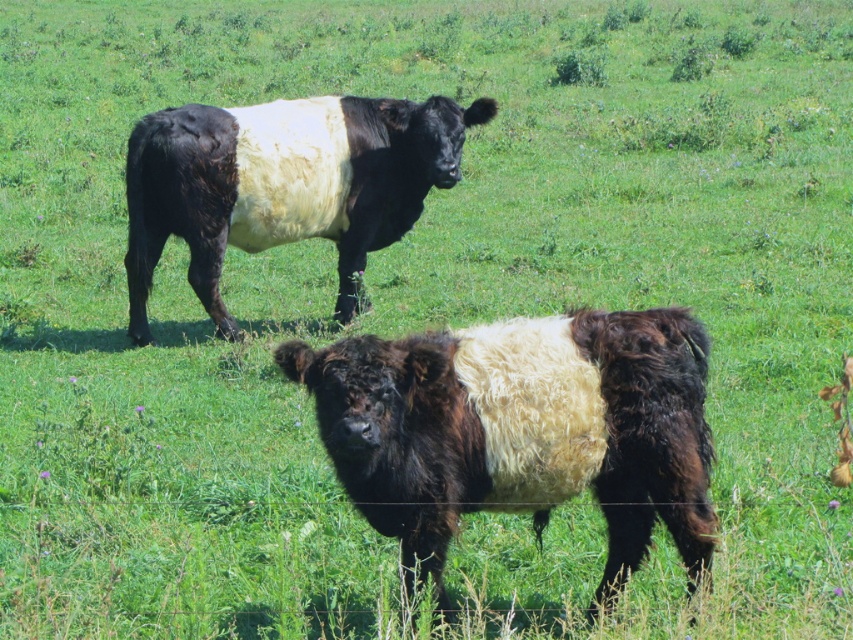
You are a farmer who wants to separate the fuzzy brown and white bull at center and the black woolly bull at upper center into two different pens. Which pen should be larger to accommodate the size difference?

The pen for the black woolly bull at upper center should be larger since it is bigger than the fuzzy brown and white bull at center.

You are a farmer trying to locate a specific point in the field where you can place a new water trough. The coordinates given are point (521, 428). According to the image, what is located at this point?

The point (521, 428) corresponds to the fuzzy brown and white bull at center, so placing the water trough there would be near the bull.

You are a photographer trying to capture a photo of the fuzzy brown and white bull at center. You want to position your camera at point A, which is at coordinates 0.5, 0.5. Will the bull be in the center of your photo if you take it from this position?

The fuzzy brown and white bull at center is located at coordinates (521, 428), which is slightly to the right and above the center point (426, 320). Therefore, the bull will not be exactly centered in the photo if you position the camera at point A.